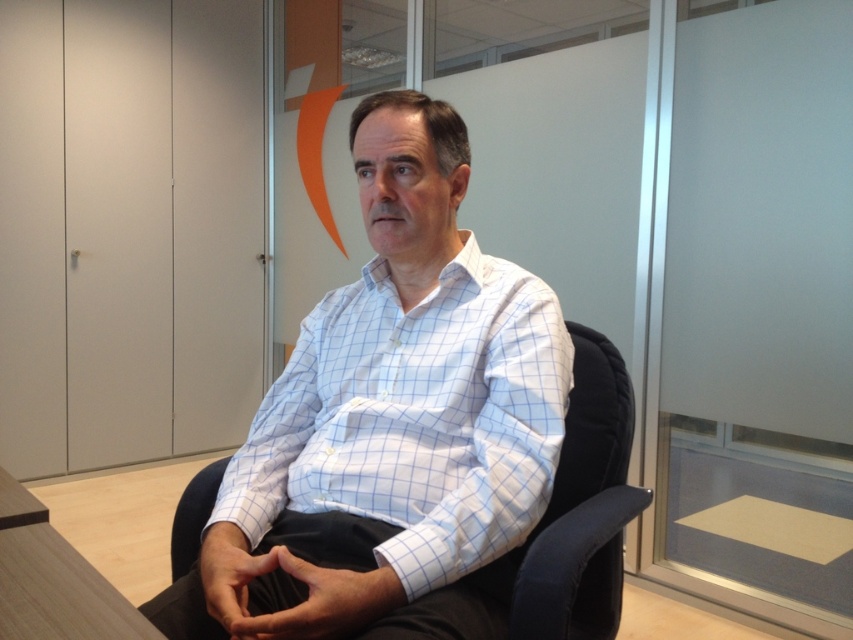
Does white checkered shirt at center have a greater width compared to black fabric swivel chair at center?

Indeed, white checkered shirt at center has a greater width compared to black fabric swivel chair at center.

Who is more forward, (421, 557) or (573, 412)?

Positioned in front is point (421, 557).

This screenshot has width=853, height=640. What do you see at coordinates (415, 419) in the screenshot?
I see `white checkered shirt at center` at bounding box center [415, 419].

Locate an element on the screen. Image resolution: width=853 pixels, height=640 pixels. white checkered shirt at center is located at coordinates (415, 419).